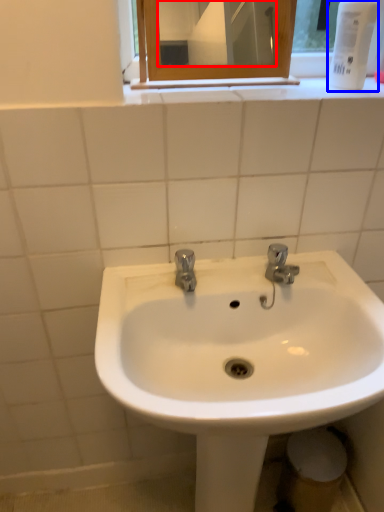
Question: Which of the following is the farthest to the observer, mirror (highlighted by a red box) or mouthwash (highlighted by a blue box)?

Choices:
 (A) mirror
 (B) mouthwash

Answer: (A)